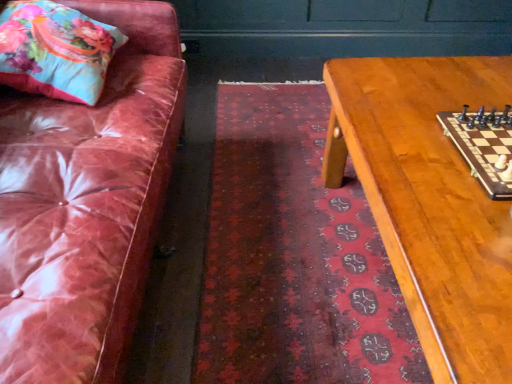
You are a GUI agent. You are given a task and a screenshot of the screen. Output one action in this format:
    pyautogui.click(x=<x>, y=<y>)
    Task: Click on the vacant space behind wooden chessboard at right
    
    Given the screenshot: What is the action you would take?
    pyautogui.click(x=425, y=92)